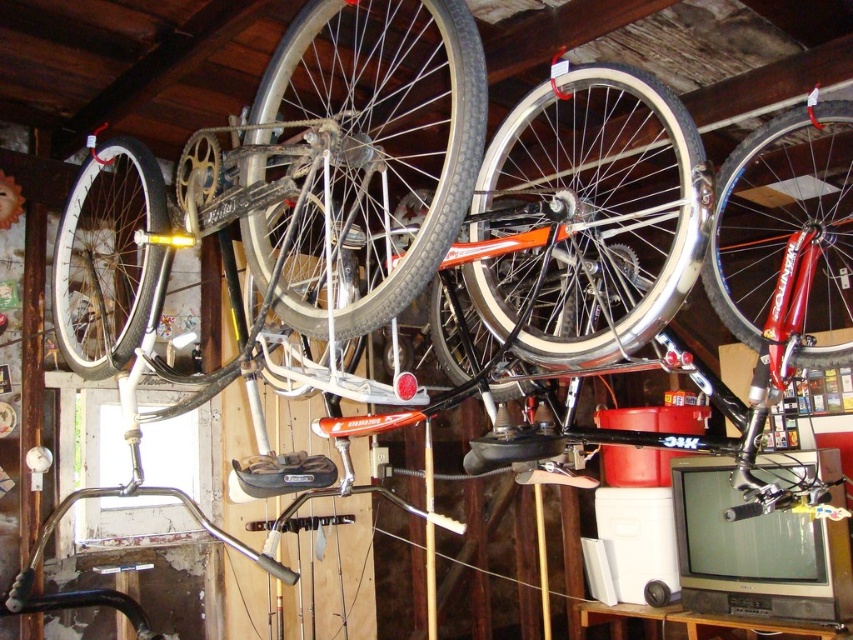
Question: Can you confirm if white rubber tire at center is positioned to the right of shiny silver rim at left?

Choices:
 (A) no
 (B) yes

Answer: (B)

Question: Estimate the real-world distances between objects in this image. Which object is farther from the shiny silver bicycle wheel at upper center?

Choices:
 (A) shiny red bicycle wheel at upper right
 (B) shiny silver rim at left
 (C) white rubber tire at center

Answer: (A)

Question: Which is farther from the shiny silver rim at left?

Choices:
 (A) shiny silver bicycle wheel at upper center
 (B) white rubber tire at center
 (C) shiny red bicycle wheel at upper right

Answer: (C)

Question: Considering the real-world distances, which object is closest to the shiny red bicycle wheel at upper right?

Choices:
 (A) white rubber tire at center
 (B) shiny silver bicycle wheel at upper center
 (C) shiny silver rim at left

Answer: (A)

Question: From the image, what is the correct spatial relationship of shiny silver bicycle wheel at upper center in relation to shiny silver rim at left?

Choices:
 (A) below
 (B) above

Answer: (B)

Question: Considering the relative positions of shiny silver bicycle wheel at upper center and shiny silver rim at left in the image provided, where is shiny silver bicycle wheel at upper center located with respect to shiny silver rim at left?

Choices:
 (A) left
 (B) right

Answer: (B)